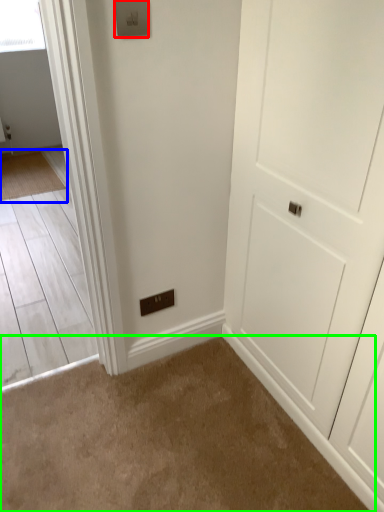
Question: Which object is the farthest from light switch (highlighted by a red box)? Choose among these: mat (highlighted by a blue box) or plain (highlighted by a green box).

Choices:
 (A) mat
 (B) plain

Answer: (A)